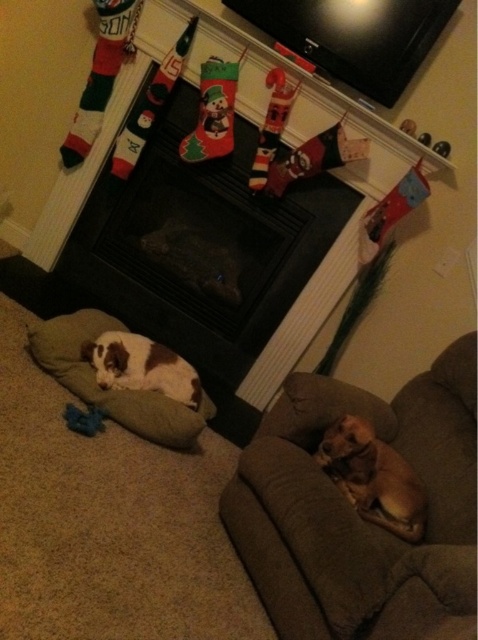
You are a guest entering the living room and want to sit on the brown fabric couch at lower right. However, there is a brown and white plush dog at lower left in the way. Can you easily move past the dog to reach the couch?

The brown fabric couch at lower right is positioned under the brown and white plush dog at lower left, so the dog is blocking the path to the couch. You would need to ask the dog to move or go around it to reach the couch.

Based on the coordinates provided, what object is located at point (x=201, y=244) in the scene?

The point (x=201, y=244) corresponds to the black matte fireplace at center.